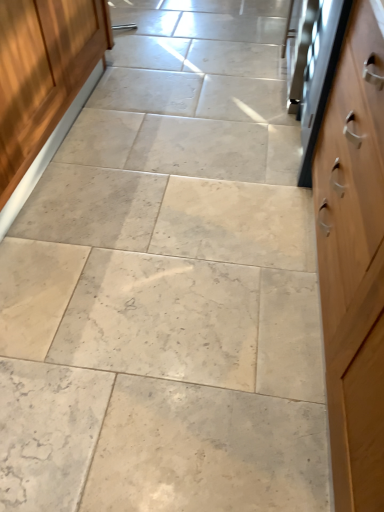
The height and width of the screenshot is (512, 384). What do you see at coordinates (319, 77) in the screenshot? I see `satin silver oven at right` at bounding box center [319, 77].

This screenshot has height=512, width=384. What are the coordinates of `satin silver oven at right` in the screenshot? It's located at (319, 77).

What do you see at coordinates (43, 73) in the screenshot? The width and height of the screenshot is (384, 512). I see `wooden cabinet at left` at bounding box center [43, 73].

Find the location of a particular element. wooden cabinet at left is located at coordinates (43, 73).

The height and width of the screenshot is (512, 384). I want to click on satin silver oven at right, so click(319, 77).

Consider the image. Considering the relative positions of wooden cabinet at left and satin silver oven at right in the image provided, is wooden cabinet at left to the left of satin silver oven at right from the viewer's perspective?

Yes.

Is wooden cabinet at left positioned in front of satin silver oven at right?

That is True.

Does point (92, 1) come in front of point (321, 47)?

No.

From the image's perspective, is wooden cabinet at left located above or below satin silver oven at right?

wooden cabinet at left is situated lower than satin silver oven at right in the image.

From a real-world perspective, who is located higher, wooden cabinet at left or satin silver oven at right?

From a 3D spatial view, satin silver oven at right is above.

Can you confirm if wooden cabinet at left is thinner than satin silver oven at right?

No, wooden cabinet at left is not thinner than satin silver oven at right.

In terms of height, does wooden cabinet at left look taller or shorter compared to satin silver oven at right?

Considering their sizes, wooden cabinet at left has less height than satin silver oven at right.

Considering the sizes of objects wooden cabinet at left and satin silver oven at right in the image provided, who is bigger, wooden cabinet at left or satin silver oven at right?

Bigger between the two is wooden cabinet at left.

Is wooden cabinet at left situated inside satin silver oven at right or outside?

wooden cabinet at left is not inside satin silver oven at right, it's outside.

Are wooden cabinet at left and satin silver oven at right making contact?

No, wooden cabinet at left is not making contact with satin silver oven at right.

Looking at this image, is wooden cabinet at left looking in the opposite direction of satin silver oven at right?

No.

How different are the orientations of wooden cabinet at left and satin silver oven at right in degrees?

89.8 degrees.

How distant is wooden cabinet at left from satin silver oven at right?

wooden cabinet at left is 1.15 meters from satin silver oven at right.

I want to click on cabinetry on the left of satin silver oven at right, so click(43, 73).

In the scene shown: Considering the positions of objects satin silver oven at right and wooden cabinet at left in the image provided, who is more to the left, satin silver oven at right or wooden cabinet at left?

Positioned to the left is wooden cabinet at left.

Which object is closer to the camera, satin silver oven at right or wooden cabinet at left?

Positioned in front is wooden cabinet at left.

Considering the points (320, 29) and (14, 134), which point is behind, point (320, 29) or point (14, 134)?

Point (320, 29)

From the image's perspective, which one is positioned lower, satin silver oven at right or wooden cabinet at left?

wooden cabinet at left is shown below in the image.

From a real-world perspective, which object stands above the other?

From a 3D spatial view, satin silver oven at right is above.

Between satin silver oven at right and wooden cabinet at left, which one has larger width?

Wider between the two is wooden cabinet at left.

Considering the sizes of objects satin silver oven at right and wooden cabinet at left in the image provided, who is shorter, satin silver oven at right or wooden cabinet at left?

wooden cabinet at left.

Can you confirm if satin silver oven at right is smaller than wooden cabinet at left?

Indeed, satin silver oven at right has a smaller size compared to wooden cabinet at left.

Would you say satin silver oven at right contains wooden cabinet at left?

Actually, wooden cabinet at left is outside satin silver oven at right.

Is satin silver oven at right in contact with wooden cabinet at left?

satin silver oven at right is not next to wooden cabinet at left, and they're not touching.

Is satin silver oven at right positioned with its back to wooden cabinet at left?

No, satin silver oven at right is not facing away from wooden cabinet at left.

How different are the orientations of satin silver oven at right and wooden cabinet at left in degrees?

They differ by 89.8 degrees in their facing directions.

Locate an element on the screen. The width and height of the screenshot is (384, 512). cabinetry below the satin silver oven at right (from a real-world perspective) is located at coordinates (43, 73).

I want to click on cabinetry that is in front of the satin silver oven at right, so click(43, 73).

Identify the location of oven that appears behind the wooden cabinet at left. The image size is (384, 512). (319, 77).